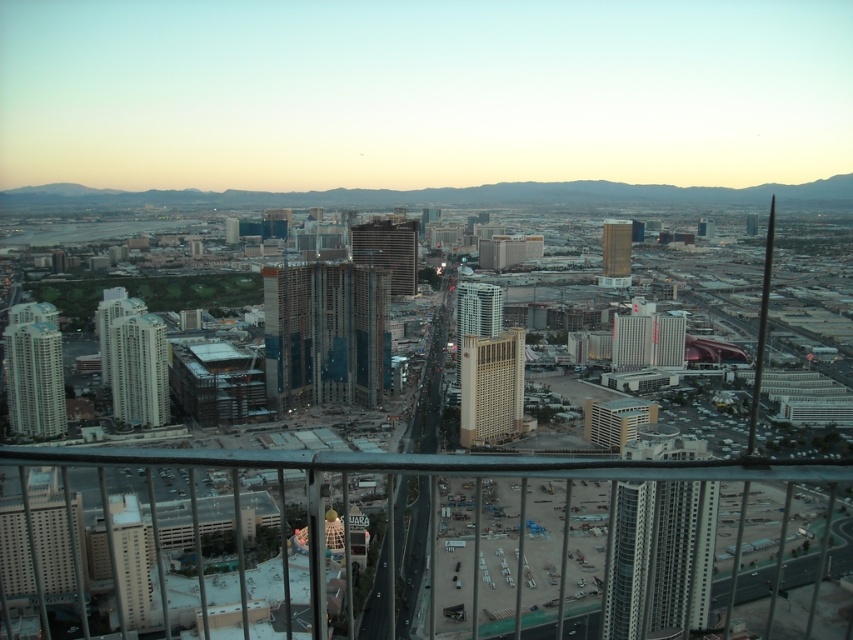
Is metallic glass skyscraper at center to the left of matte glass skyscraper at left from the viewer's perspective?

In fact, metallic glass skyscraper at center is to the right of matte glass skyscraper at left.

Who is more forward, [611,584] or [9,332]?

Point [611,584] is in front.

What are the coordinates of `metallic glass skyscraper at center` in the screenshot? It's located at 630,560.

Based on the photo, who is more distant from viewer, (706, 596) or (456, 371)?

The point (456, 371) is behind.

Is metallic glass skyscraper at center shorter than matte glass skyscraper at center?

No, metallic glass skyscraper at center is not shorter than matte glass skyscraper at center.

Locate an element on the screen. The image size is (853, 640). metallic glass skyscraper at center is located at coordinates (630, 560).

You are a GUI agent. You are given a task and a screenshot of the screen. Output one action in this format:
    pyautogui.click(x=<x>, y=<y>)
    Task: Click on the metallic glass skyscraper at center
    The image size is (853, 640).
    Given the screenshot: What is the action you would take?
    pyautogui.click(x=630, y=560)

Between dark brown glass skyscraper at center and matte white building at left, which one is positioned lower?

matte white building at left is below.

Which is more to the right, dark brown glass skyscraper at center or matte white building at left?

dark brown glass skyscraper at center

Is point (402, 266) positioned in front of point (120, 316)?

No.

Where is `dark brown glass skyscraper at center`? Image resolution: width=853 pixels, height=640 pixels. dark brown glass skyscraper at center is located at coordinates (387, 250).